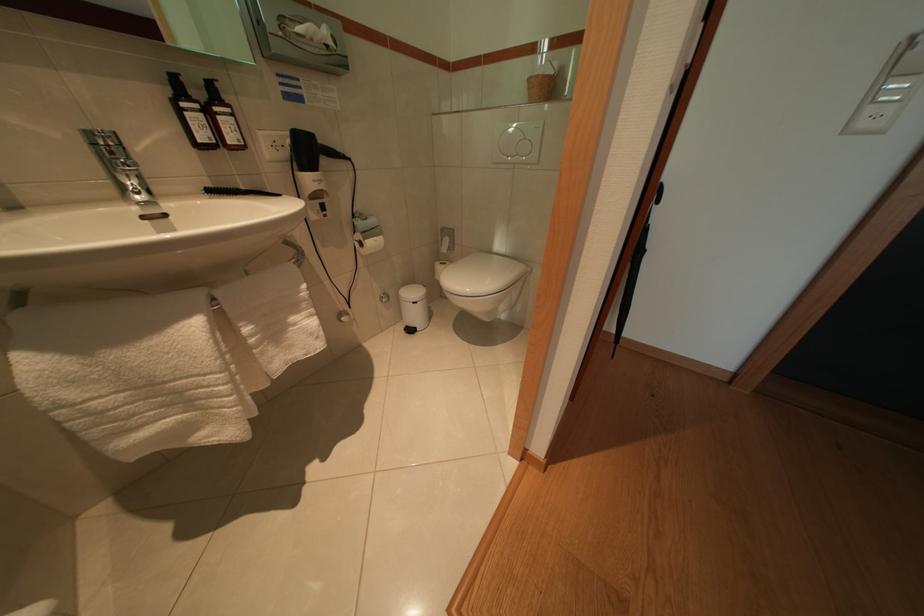
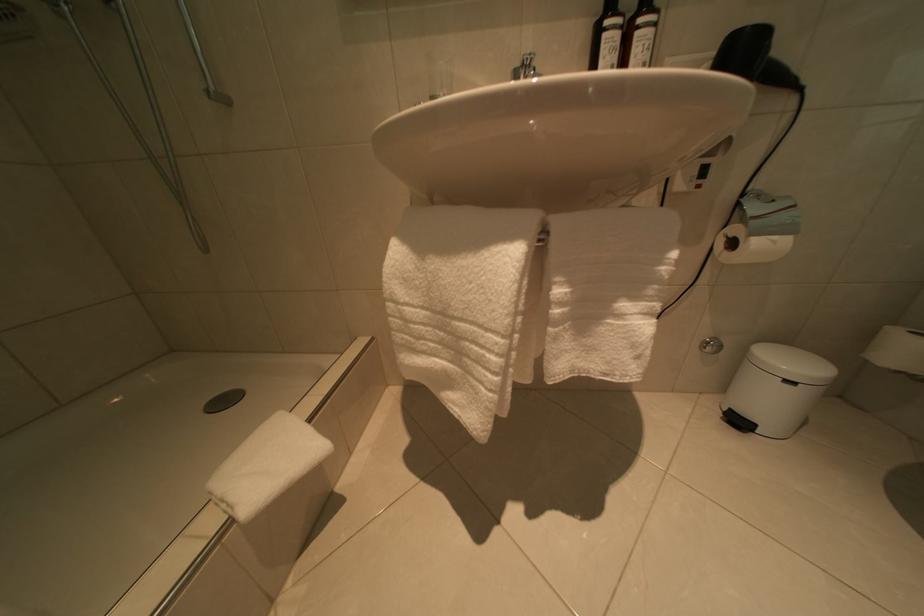
Where in the second image is the point corresponding to (x=370, y=249) from the first image?

(740, 249)